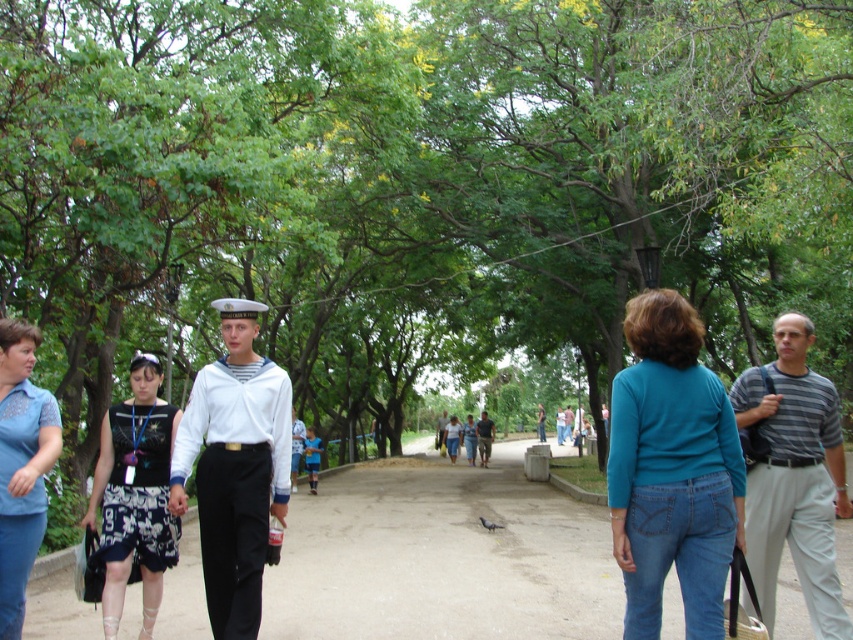
You are standing at the center of the park and see a point marked at coordinates [672,470]. What object is located at that point?

The point at coordinates [672,470] corresponds to the teal sweater at center.

You are a photographer trying to capture both the gray striped shirt at right and the black printed dress at left in a single shot. Since the camera can only focus on one subject at a time, which one should you focus on to ensure the other remains visible in the background?

You should focus on the gray striped shirt at right because it is in front of the black printed dress at left, so the dress will be in the background and still visible.

You are a photographer trying to capture both the white cotton sailor suit at center and the white cotton shirt at center in a single frame. Which object should you focus on first to ensure both are in the frame?

The white cotton sailor suit at center is taller than the white cotton shirt at center, so focus on the white cotton sailor suit at center first to ensure both are in the frame.